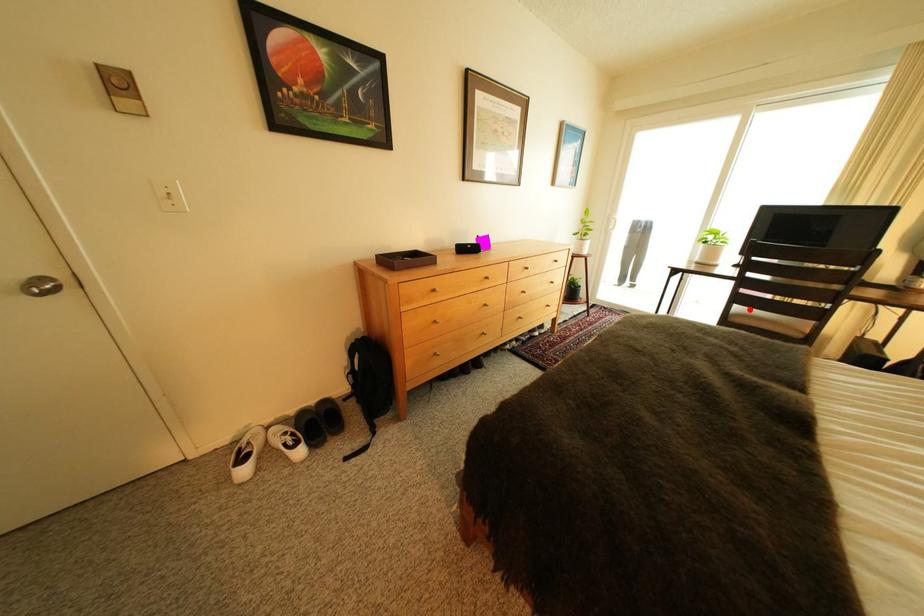
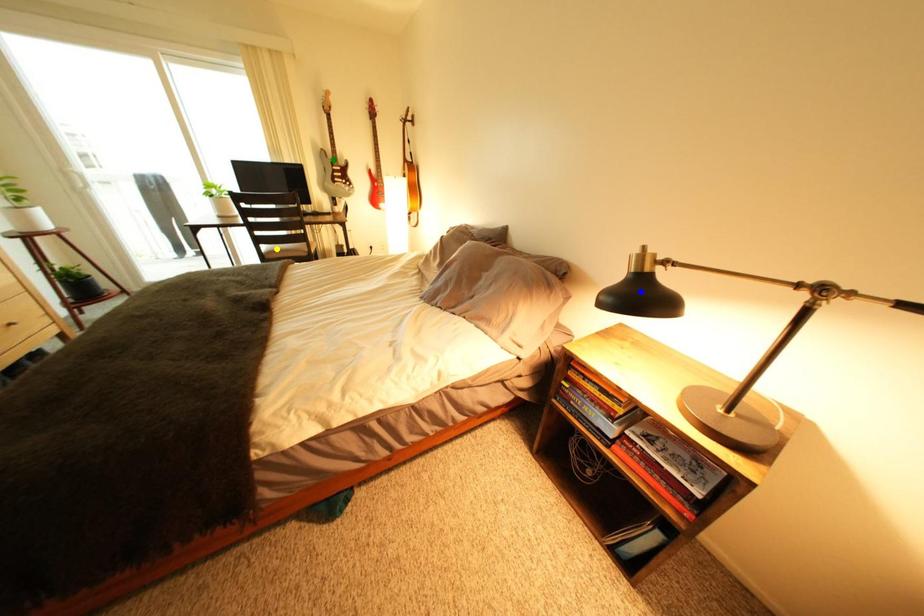
Question: I am providing you with two images of the same scene from different viewpoints. A red point is marked on the first image. You are given multiple points on the second image. Can you choose the point in image 2 that corresponds to the point in image 1?

Choices:
 (A) blue point
 (B) yellow point
 (C) green point

Answer: (B)